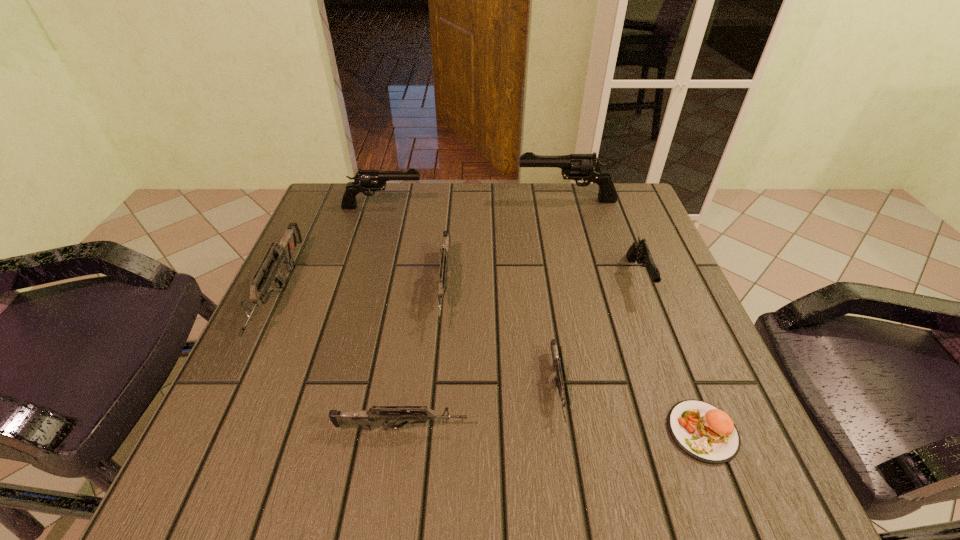
Locate an element on the screen. vacant region located aimed along the barrel of the rightmost grey gun is located at coordinates (571, 481).

Find the location of a particular element. This screenshot has height=540, width=960. free space located on the back of the shortest object is located at coordinates tap(643, 281).

This screenshot has height=540, width=960. Find the location of `object present at the near edge`. object present at the near edge is located at coordinates (703, 431).

The image size is (960, 540). In order to click on patty at the right edge in this screenshot , I will do `click(703, 431)`.

The image size is (960, 540). Identify the location of object that is positioned at the far left corner. (365, 180).

You are a GUI agent. You are given a task and a screenshot of the screen. Output one action in this format:
    pyautogui.click(x=<x>, y=<y>)
    Task: Click on the object that is at the far right corner
    This screenshot has width=960, height=540.
    Given the screenshot: What is the action you would take?
    pyautogui.click(x=587, y=167)

Find the location of a particular element. The width and height of the screenshot is (960, 540). object that is at the near right corner is located at coordinates (703, 431).

The height and width of the screenshot is (540, 960). Identify the location of free region at the far edge. click(x=471, y=210).

Locate an element on the screen. The width and height of the screenshot is (960, 540). free space at the near edge of the desktop is located at coordinates (423, 475).

Image resolution: width=960 pixels, height=540 pixels. I want to click on vacant area at the left edge of the desktop, so click(210, 433).